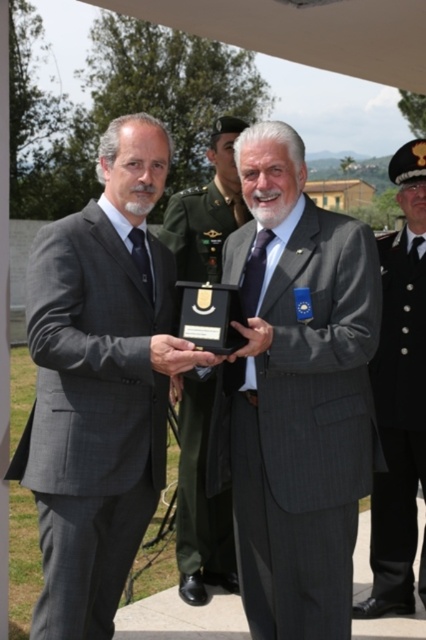
Can you confirm if matte black plaque at center is positioned below black uniform at right?

Incorrect, matte black plaque at center is not positioned below black uniform at right.

Which is more to the right, matte black plaque at center or black uniform at right?

From the viewer's perspective, black uniform at right appears more on the right side.

This screenshot has width=426, height=640. Identify the location of matte black plaque at center. (199, 500).

The width and height of the screenshot is (426, 640). What do you see at coordinates (296, 394) in the screenshot?
I see `matte gray suit at center` at bounding box center [296, 394].

Between point (273, 262) and point (192, 544), which one is positioned in front?

Positioned in front is point (273, 262).

What are the coordinates of `matte gray suit at center` in the screenshot? It's located at (296, 394).

Measure the distance between matte gray suit at center and black uniform at right.

A distance of 86.70 centimeters exists between matte gray suit at center and black uniform at right.

Locate an element on the screen. matte gray suit at center is located at coordinates (296, 394).